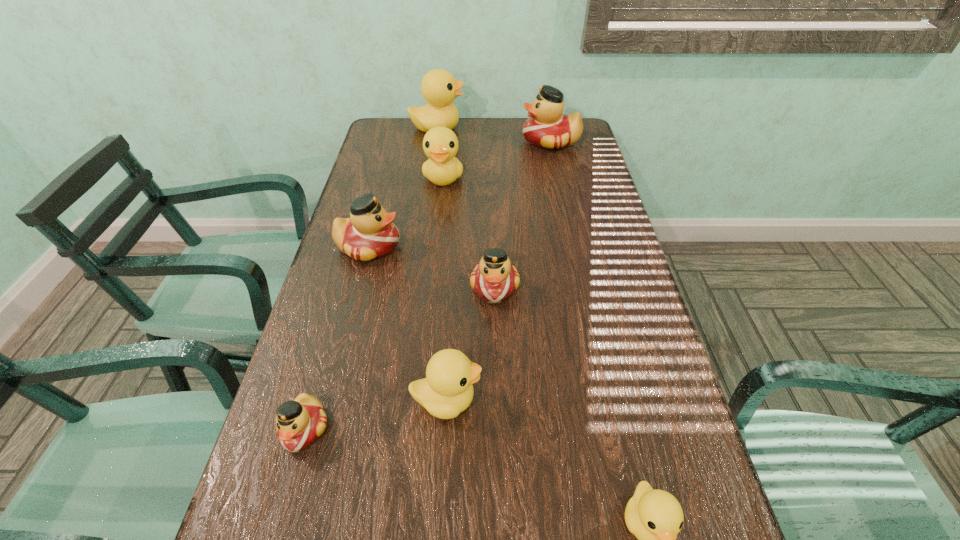
The image size is (960, 540). In order to click on object that is at the right edge in this screenshot , I will do `click(548, 128)`.

You are a GUI agent. You are given a task and a screenshot of the screen. Output one action in this format:
    pyautogui.click(x=<x>, y=<y>)
    Task: Click on the object that is at the far left corner
    
    Given the screenshot: What is the action you would take?
    pyautogui.click(x=439, y=88)

Locate an element on the screen. object that is at the far right corner is located at coordinates (548, 128).

In the image, there is a desktop. At what (x,y) coordinates should I click in order to perform the action: click on vacant space at the far edge. Please return your answer as a coordinate pair (x, y). The image size is (960, 540). Looking at the image, I should click on (523, 147).

This screenshot has height=540, width=960. Find the location of `vacant space at the left edge`. vacant space at the left edge is located at coordinates (375, 289).

Find the location of `blank space at the right edge of the desktop`. blank space at the right edge of the desktop is located at coordinates (552, 171).

This screenshot has height=540, width=960. What are the coordinates of `empty space between the sixth nearest duck and the second nearest yellow duck` in the screenshot? It's located at (444, 289).

The image size is (960, 540). I want to click on vacant space that's between the fourth nearest object and the second biggest yellow duck, so click(469, 232).

At what (x,y) coordinates should I click in order to perform the action: click on free area in between the nearest red duck and the farthest yellow duck. Please return your answer as a coordinate pair (x, y). Looking at the image, I should click on (372, 278).

Find the location of a particular element. unoccupied position between the farthest red duck and the third farthest duck is located at coordinates (497, 159).